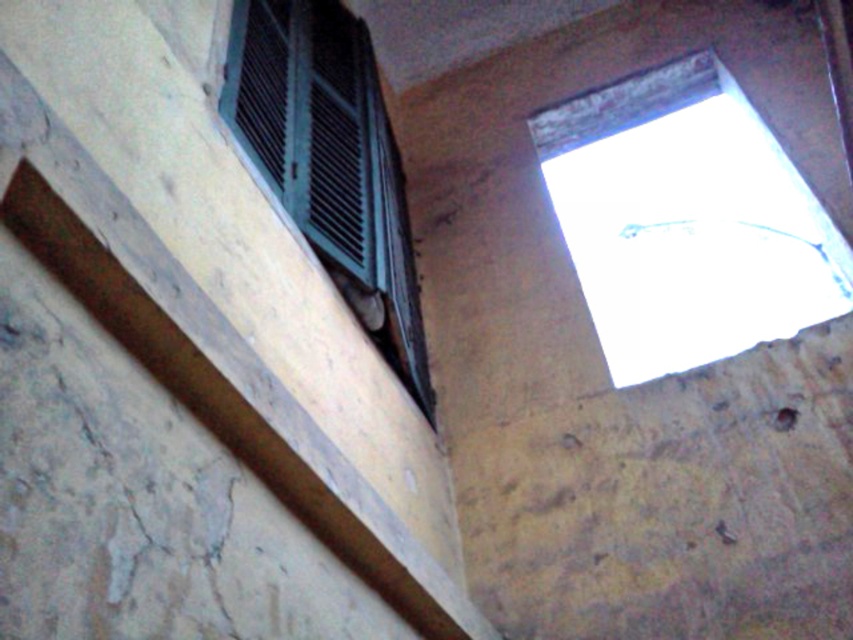
Question: Among these objects, which one is nearest to the camera?

Choices:
 (A) green matte window at upper left
 (B) brown wood beam at upper left

Answer: (B)

Question: Which of the following is the closest to the observer?

Choices:
 (A) brown wood beam at upper left
 (B) green matte window at upper left
 (C) transparent glass window at upper right

Answer: (A)

Question: Is transparent glass window at upper right wider than green matte window at upper left?

Choices:
 (A) no
 (B) yes

Answer: (B)

Question: Which point appears farthest from the camera in this image?

Choices:
 (A) (84, 269)
 (B) (799, 285)

Answer: (B)

Question: Does brown wood beam at upper left appear under green matte window at upper left?

Choices:
 (A) yes
 (B) no

Answer: (A)

Question: Is transparent glass window at upper right above green matte window at upper left?

Choices:
 (A) yes
 (B) no

Answer: (B)